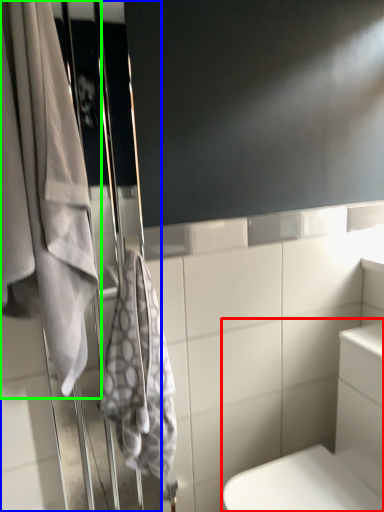
Question: Estimate the real-world distances between objects in this image. Which object is closer to bath (highlighted by a red box), screen door (highlighted by a blue box) or towel (highlighted by a green box)?

Choices:
 (A) screen door
 (B) towel

Answer: (A)